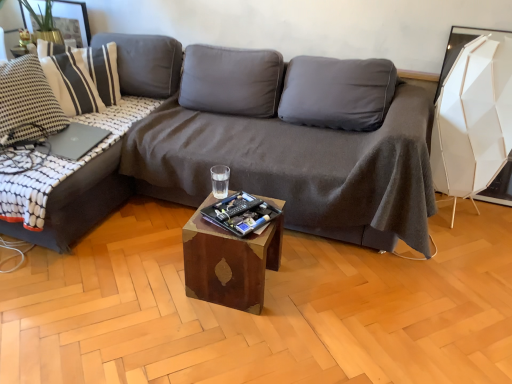
This screenshot has width=512, height=384. I want to click on free spot to the left of wooden cube at center, so click(x=158, y=284).